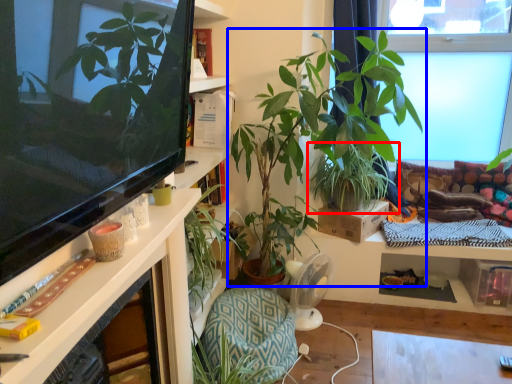
Question: Among these objects, which one is nearest to the camera, houseplant (highlighted by a red box) or houseplant (highlighted by a blue box)?

Choices:
 (A) houseplant
 (B) houseplant

Answer: (B)